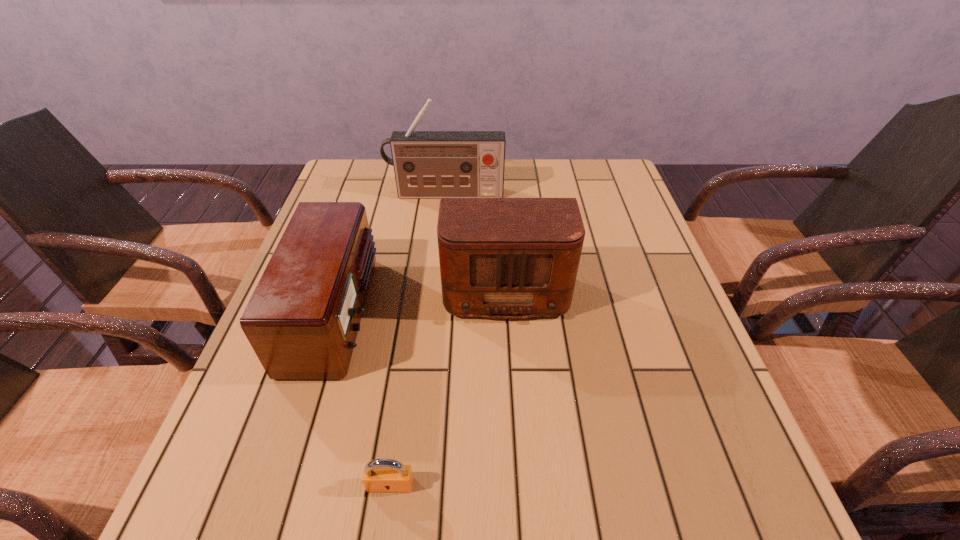
This screenshot has height=540, width=960. What are the coordinates of `object at the far edge` in the screenshot? It's located at (427, 164).

The image size is (960, 540). Find the location of `object that is at the near edge`. object that is at the near edge is located at coordinates (380, 475).

I want to click on object that is at the left edge, so click(302, 320).

Identify the location of blank area at the far edge. (528, 160).

In order to click on vacant region at the near edge in this screenshot , I will do `click(299, 491)`.

The height and width of the screenshot is (540, 960). I want to click on free space at the right edge of the desktop, so click(x=667, y=368).

In the image, there is a desktop. What are the coordinates of `vacant space at the far left corner` in the screenshot? It's located at (341, 166).

In the image, there is a desktop. Find the location of `vacant area at the far right corner`. vacant area at the far right corner is located at coordinates (601, 200).

Locate an element on the screen. The image size is (960, 540). unoccupied position between the shortest radio receiver and the padlock is located at coordinates (363, 399).

The height and width of the screenshot is (540, 960). What are the coordinates of `free area in between the shortest radio receiver and the third shortest object` in the screenshot? It's located at (420, 299).